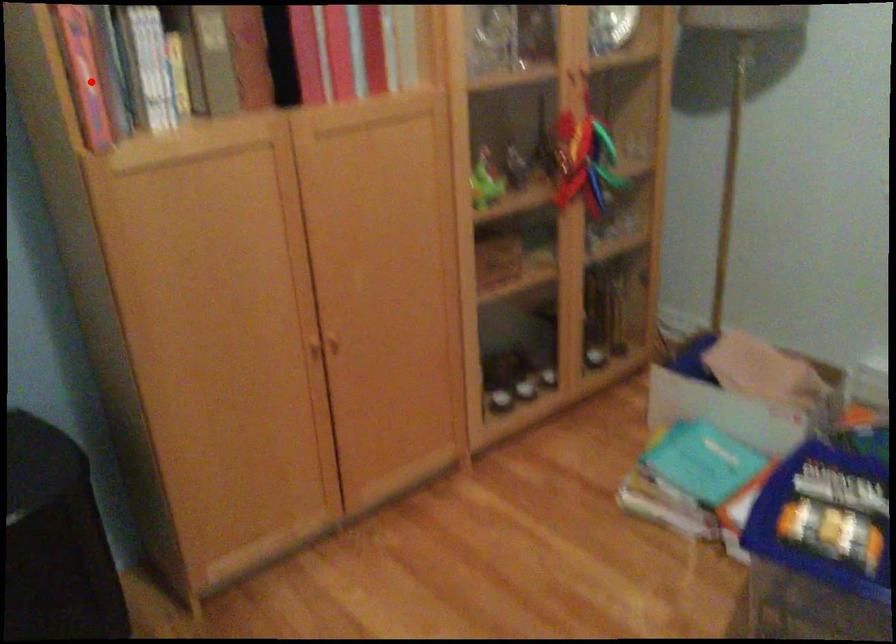
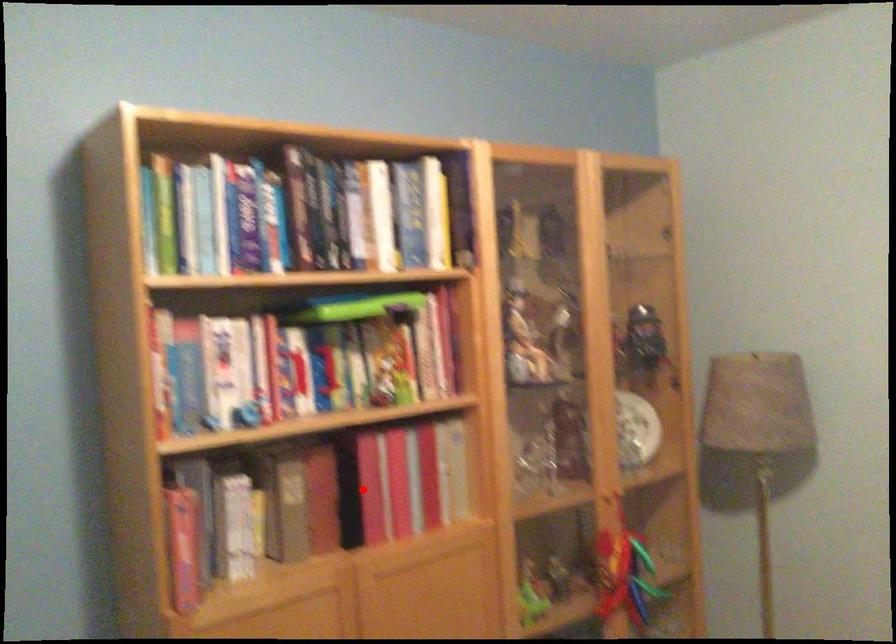
I am providing you with two images of the same scene from different viewpoints. A red point is marked on the first image and another point is marked on the second image. Do the highlighted points in image1 and image2 indicate the same real-world spot?

No